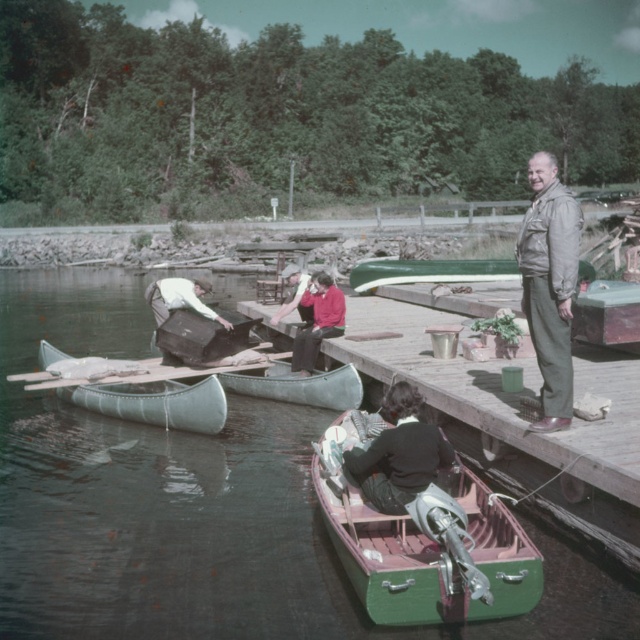
Question: Which object is positioned closest to the dark green fabric jacket at lower center?

Choices:
 (A) green rubber boat at lower left
 (B) khaki fabric jacket at right

Answer: (B)

Question: Considering the real-world distances, which object is closest to the green polished wood boat at lower center?

Choices:
 (A) dark green fabric jacket at lower center
 (B) red cotton shirt at center
 (C) green canvas canoe at center

Answer: (A)

Question: Can you confirm if dark green fabric jacket at lower center is smaller than light brown leather jacket at center?

Choices:
 (A) no
 (B) yes

Answer: (B)

Question: Which point is closer to the camera?

Choices:
 (A) green canvas canoe at center
 (B) light brown leather jacket at center

Answer: (A)

Question: In this image, where is dark green fabric jacket at lower center located relative to green canvas canoe at center?

Choices:
 (A) below
 (B) above

Answer: (A)

Question: Is dark green fabric jacket at lower center wider than green canvas canoe at center?

Choices:
 (A) yes
 (B) no

Answer: (B)